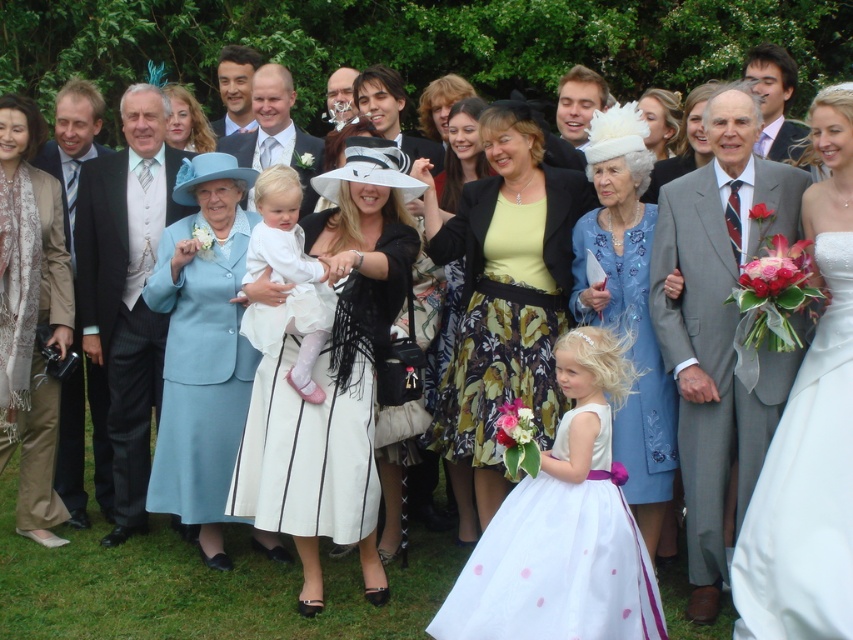
Question: Does matte gray suit at center have a smaller size compared to matte blue dress at center?

Choices:
 (A) yes
 (B) no

Answer: (A)

Question: Among these points, which one is farthest from the camera?

Choices:
 (A) (740, 554)
 (B) (215, 131)
 (C) (16, 339)
 (D) (190, 106)

Answer: (B)

Question: Does white satin dress at center appear on the left side of matte blue dress at center?

Choices:
 (A) yes
 (B) no

Answer: (B)

Question: Which point is farther to the camera?

Choices:
 (A) (585, 109)
 (B) (223, 266)
 (C) (575, 504)

Answer: (A)

Question: Which point is closer to the camera?

Choices:
 (A) (717, 220)
 (B) (9, 218)
 (C) (257, 60)

Answer: (A)

Question: Does light blue fabric dress at left have a lesser width compared to light blue fabric suit at center?

Choices:
 (A) no
 (B) yes

Answer: (B)